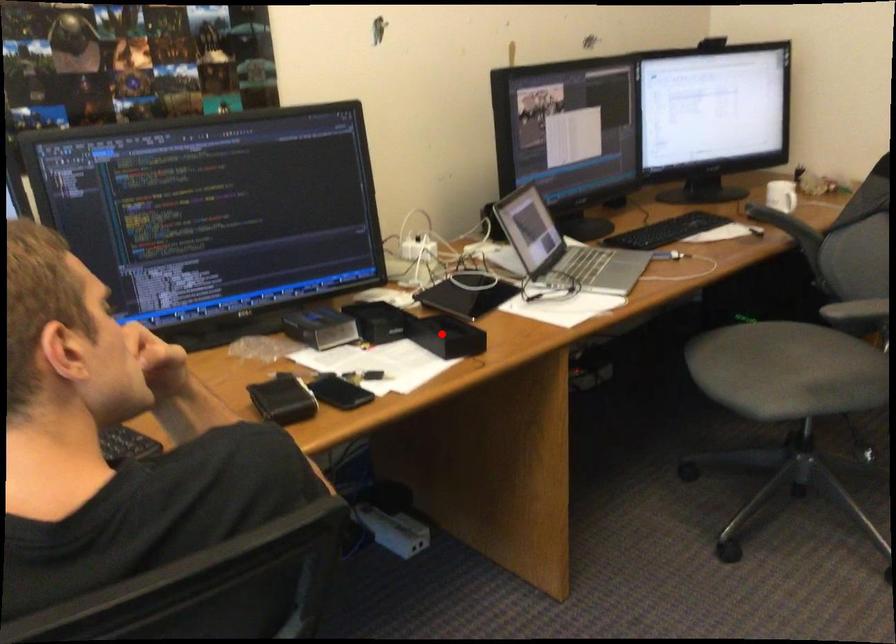
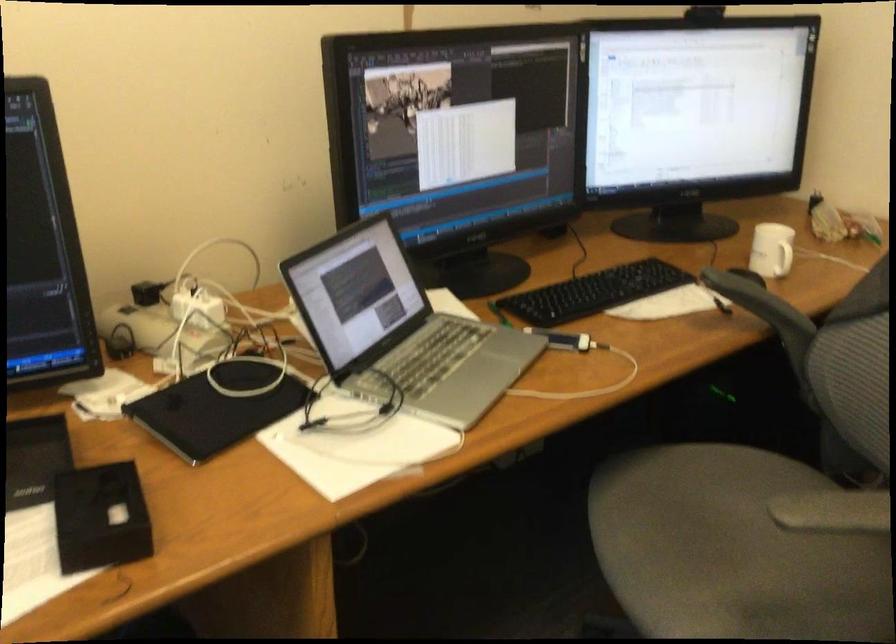
Question: I am providing you with two images of the same scene from different viewpoints. Given a red point in image1, look at the same physical point in image2. Is it:

Choices:
 (A) Closer to the viewpoint
 (B) Farther from the viewpoint

Answer: (A)